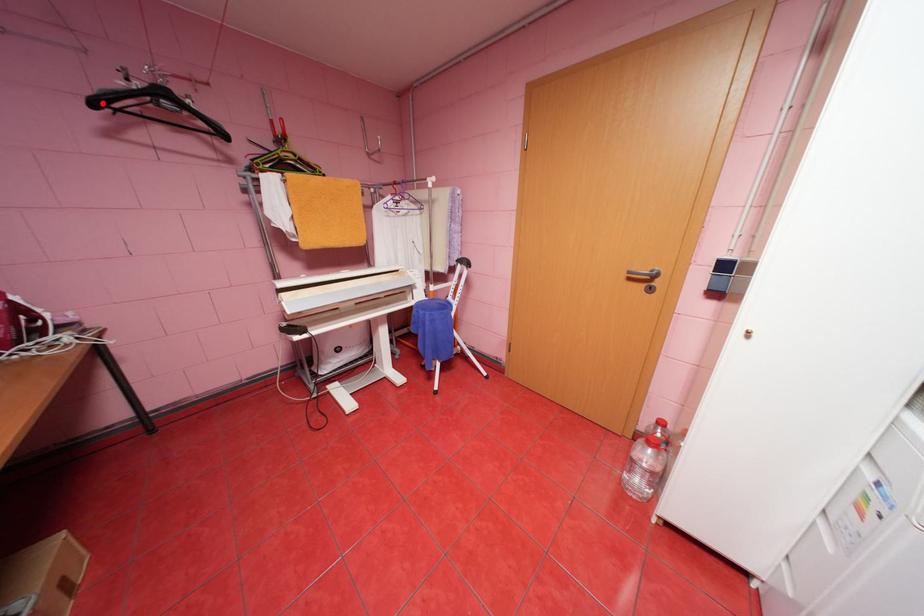
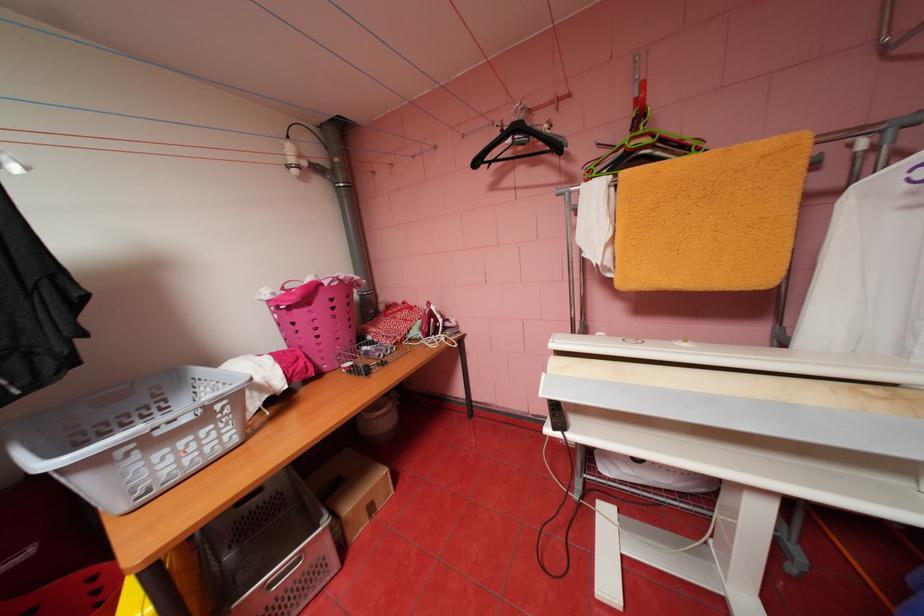
Question: A red point is marked in image1. In image2, is the corresponding 3D point closer to the camera or farther? Reply with the corresponding letter.

Choices:
 (A) The corresponding 3D point is closer.
 (B) The corresponding 3D point is farther.

Answer: (A)